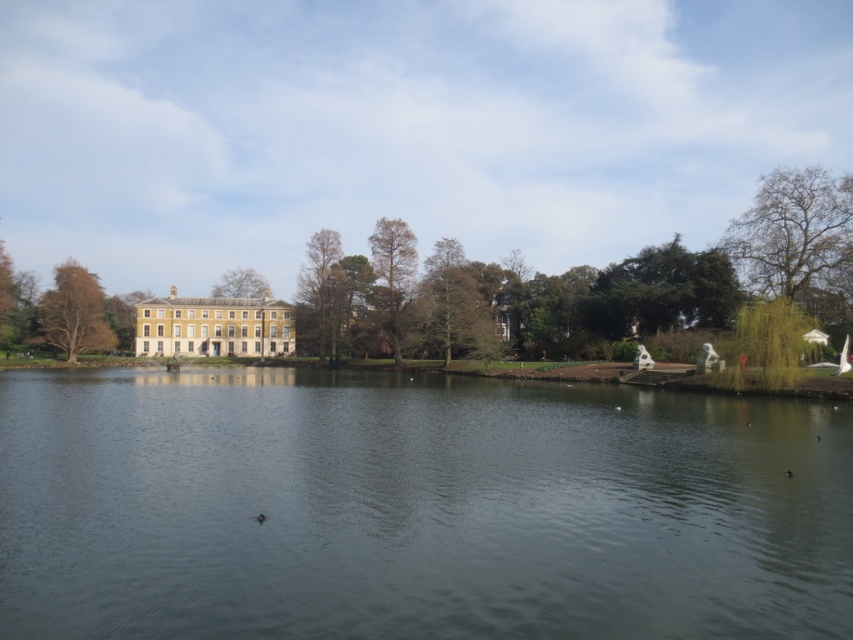
You are a GUI agent. You are given a task and a screenshot of the screen. Output one action in this format:
    pyautogui.click(x=<x>, y=<y>)
    Task: Click on the beige stone palace at center
    The image size is (853, 640).
    Given the screenshot: What is the action you would take?
    pyautogui.click(x=213, y=326)

Can you confirm if beige stone palace at center is shorter than brown textured tree at center?

Indeed, beige stone palace at center has a lesser height compared to brown textured tree at center.

Which is in front, point (193, 349) or point (412, 244)?

Positioned in front is point (412, 244).

Image resolution: width=853 pixels, height=640 pixels. In order to click on beige stone palace at center in this screenshot , I will do `click(213, 326)`.

Which is above, dark gray water at center or brown textured tree at center?

brown textured tree at center is higher up.

Can you confirm if dark gray water at center is positioned above brown textured tree at center?

No, dark gray water at center is not above brown textured tree at center.

Is point (389, 490) positioned in front of point (397, 252)?

Yes, point (389, 490) is in front of point (397, 252).

Locate an element on the screen. dark gray water at center is located at coordinates (415, 508).

Is green matte tree at center above brown leafy tree at left?

Yes, green matte tree at center is above brown leafy tree at left.

Can you confirm if green matte tree at center is bigger than brown leafy tree at left?

No.

Is point (311, 330) farther from camera compared to point (51, 332)?

Yes, point (311, 330) is behind point (51, 332).

The image size is (853, 640). What are the coordinates of `green matte tree at center` in the screenshot? It's located at (322, 296).